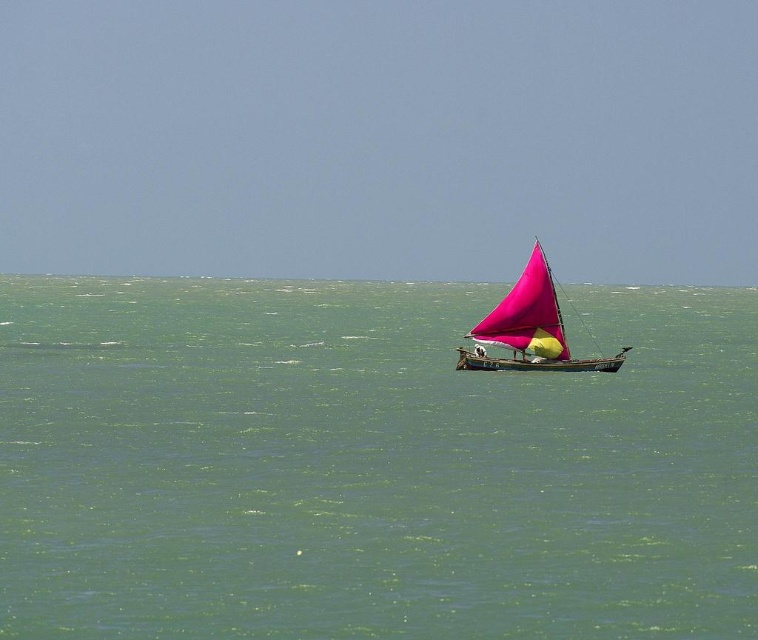
Who is lower down, green water at center or pink fabric sailboat at center?

pink fabric sailboat at center is lower down.

Which is in front, point (688, 321) or point (540, 333)?

Point (540, 333) is more forward.

Find the location of a particular element. The height and width of the screenshot is (640, 758). green water at center is located at coordinates (368, 465).

Identify the location of green water at center. The height and width of the screenshot is (640, 758). (368, 465).